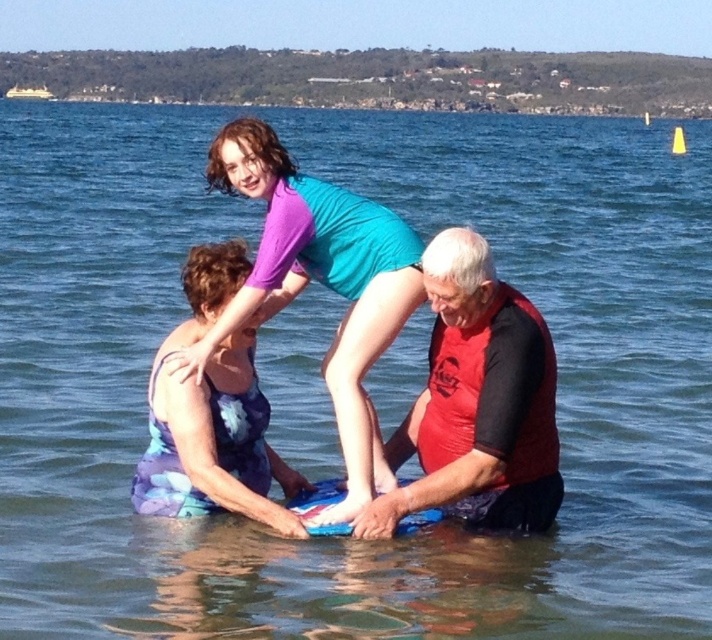
Identify the location of red matte wetsuit at center. (476, 401).

Does red matte wetsuit at center appear under matte purple swimsuit at center?

Indeed, red matte wetsuit at center is positioned under matte purple swimsuit at center.

This screenshot has width=712, height=640. I want to click on red matte wetsuit at center, so click(x=476, y=401).

Is point (283, 262) closer to camera compared to point (157, 436)?

No, it is behind (157, 436).

From the picture: Is matte purple swimsuit at center to the right of purple fabric dress at lower left from the viewer's perspective?

Incorrect, matte purple swimsuit at center is not on the right side of purple fabric dress at lower left.

Is point (308, 273) farther from viewer compared to point (157, 440)?

Yes, point (308, 273) is behind point (157, 440).

At what (x,y) coordinates should I click in order to perform the action: click on matte purple swimsuit at center. Please return your answer as a coordinate pair (x, y). Looking at the image, I should click on (320, 282).

Is point (436, 396) in front of point (276, 504)?

No, (436, 396) is further to viewer.

Is point (451, 397) farther from camera compared to point (164, 428)?

Yes, it is.

At what (x,y) coordinates should I click in order to perform the action: click on red matte wetsuit at center. Please return your answer as a coordinate pair (x, y). The image size is (712, 640). Looking at the image, I should click on (476, 401).